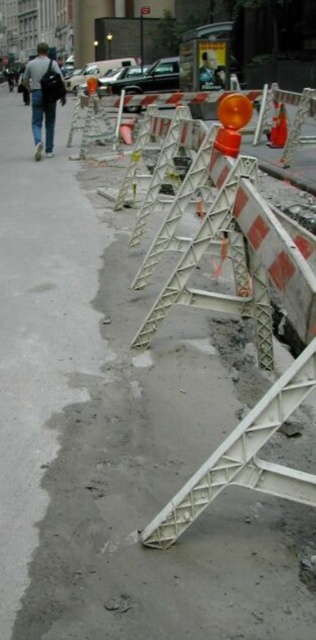
Between light gray backpack at left and orange reflective cone at center, which one is positioned higher?

light gray backpack at left is higher up.

Can you confirm if light gray backpack at left is shorter than orange reflective cone at center?

No.

Which is in front, point (44, 150) or point (284, 104)?

Positioned in front is point (284, 104).

Identify the location of light gray backpack at left. This screenshot has height=640, width=316. (43, 97).